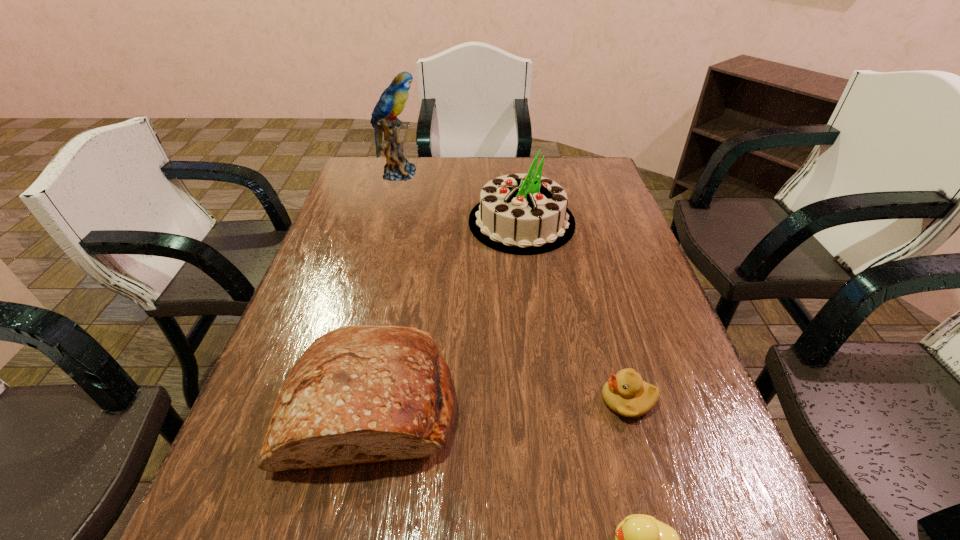
The height and width of the screenshot is (540, 960). I want to click on the farthest object, so click(x=392, y=101).

At what (x,y) coordinates should I click in order to perform the action: click on parrot. Please return your answer as a coordinate pair (x, y). Looking at the image, I should click on pyautogui.click(x=392, y=101).

Locate an element on the screen. The width and height of the screenshot is (960, 540). the fourth nearest object is located at coordinates click(522, 214).

Find the location of `birthday cake`. birthday cake is located at coordinates (522, 214).

The width and height of the screenshot is (960, 540). What are the coordinates of `bread` in the screenshot? It's located at (359, 394).

This screenshot has width=960, height=540. I want to click on the farther duckling, so click(x=625, y=393).

In order to click on vacant region located on the face of the farthest object in this screenshot , I will do `click(490, 173)`.

Find the location of a particular element. The width and height of the screenshot is (960, 540). vacant region located on the left of the birthday cake is located at coordinates (452, 222).

The width and height of the screenshot is (960, 540). I want to click on vacant space located on the front-facing side of the farther duckling, so click(x=497, y=400).

The height and width of the screenshot is (540, 960). In order to click on vacant space situated 0.100m on the front-facing side of the farther duckling in this screenshot , I will do `click(551, 400)`.